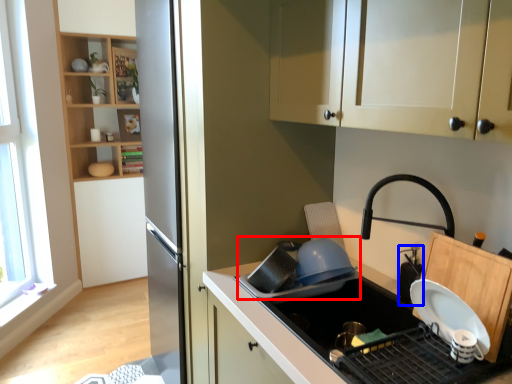
Question: Which object appears farthest to the camera in this image, appliance (highlighted by a red box) or appliance (highlighted by a blue box)?

Choices:
 (A) appliance
 (B) appliance

Answer: (A)